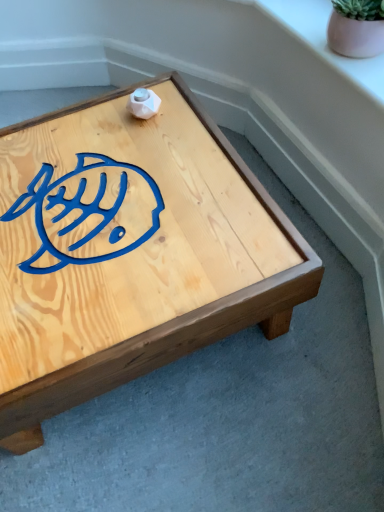
The width and height of the screenshot is (384, 512). Identify the location of pink matte flowerpot at upper right. (356, 28).

I want to click on pink ceramic pot at upper right, so click(326, 42).

What do you see at coordinates (130, 251) in the screenshot? I see `natural wood coffee table at center` at bounding box center [130, 251].

Identify the location of pink matte flowerpot at upper right. This screenshot has height=512, width=384. click(x=356, y=28).

Is pink ceramic pot at upper right far away from pink matte flowerpot at upper right?

No, pink ceramic pot at upper right is not far from pink matte flowerpot at upper right.

Does pink ceramic pot at upper right have a lesser width compared to pink matte flowerpot at upper right?

In fact, pink ceramic pot at upper right might be wider than pink matte flowerpot at upper right.

From a real-world perspective, which is physically below, pink ceramic pot at upper right or pink matte flowerpot at upper right?

pink ceramic pot at upper right.

Between natural wood coffee table at center and pink matte flowerpot at upper right, which one has more height?

natural wood coffee table at center is taller.

Is natural wood coffee table at center to the left of pink matte flowerpot at upper right from the viewer's perspective?

Correct, you'll find natural wood coffee table at center to the left of pink matte flowerpot at upper right.

From a real-world perspective, between natural wood coffee table at center and pink matte flowerpot at upper right, who is vertically higher?

In real-world perspective, pink matte flowerpot at upper right is above.

Considering the sizes of pink matte flowerpot at upper right and pink ceramic pot at upper right in the image, is pink matte flowerpot at upper right wider or thinner than pink ceramic pot at upper right?

In the image, pink matte flowerpot at upper right appears to be more narrow than pink ceramic pot at upper right.

Are pink matte flowerpot at upper right and pink ceramic pot at upper right far apart?

No, pink matte flowerpot at upper right is not far away from pink ceramic pot at upper right.

Is pink matte flowerpot at upper right facing away from pink ceramic pot at upper right?

pink matte flowerpot at upper right is not turned away from pink ceramic pot at upper right.

From the image's perspective, is pink matte flowerpot at upper right on pink ceramic pot at upper right?

No, from the image's perspective, pink matte flowerpot at upper right is not above pink ceramic pot at upper right.

Does natural wood coffee table at center have a lesser width compared to pink ceramic pot at upper right?

No, natural wood coffee table at center is not thinner than pink ceramic pot at upper right.

Is natural wood coffee table at center closer to the viewer compared to pink ceramic pot at upper right?

Yes, natural wood coffee table at center is closer to the camera.

Where is `window sill above the natural wood coffee table at center (from a real-world perspective)`? window sill above the natural wood coffee table at center (from a real-world perspective) is located at coordinates (326, 42).

Do you think pink ceramic pot at upper right is within natural wood coffee table at center, or outside of it?

pink ceramic pot at upper right lies outside natural wood coffee table at center.

Who is shorter, pink ceramic pot at upper right or natural wood coffee table at center?

Standing shorter between the two is pink ceramic pot at upper right.

Is pink ceramic pot at upper right closer to the viewer compared to natural wood coffee table at center?

No, pink ceramic pot at upper right is behind natural wood coffee table at center.

In terms of height, does pink matte flowerpot at upper right look taller or shorter compared to natural wood coffee table at center?

pink matte flowerpot at upper right is shorter than natural wood coffee table at center.

From the image's perspective, would you say pink matte flowerpot at upper right is positioned over natural wood coffee table at center?

Yes, from the image's perspective, pink matte flowerpot at upper right is above natural wood coffee table at center.

Based on the photo, in terms of size, does pink matte flowerpot at upper right appear bigger or smaller than natural wood coffee table at center?

Considering their sizes, pink matte flowerpot at upper right takes up less space than natural wood coffee table at center.

From the picture: Is pink matte flowerpot at upper right facing away from natural wood coffee table at center?

No, natural wood coffee table at center is not at the back of pink matte flowerpot at upper right.

Locate an element on the screen. This screenshot has height=512, width=384. flowerpot on the right of the pink ceramic pot at upper right is located at coordinates (356, 28).

This screenshot has width=384, height=512. What are the coordinates of `coffee table below the pink matte flowerpot at upper right (from a real-world perspective)` in the screenshot? It's located at (130, 251).

Based on their spatial positions, is natural wood coffee table at center or pink matte flowerpot at upper right closer to pink ceramic pot at upper right?

pink matte flowerpot at upper right is positioned closer to the anchor pink ceramic pot at upper right.

Estimate the real-world distances between objects in this image. Which object is further from natural wood coffee table at center, pink ceramic pot at upper right or pink matte flowerpot at upper right?

pink matte flowerpot at upper right.

In the scene shown: Estimate the real-world distances between objects in this image. Which object is closer to pink ceramic pot at upper right, pink matte flowerpot at upper right or natural wood coffee table at center?

The object closer to pink ceramic pot at upper right is pink matte flowerpot at upper right.

From the image, which object appears to be nearer to pink matte flowerpot at upper right, natural wood coffee table at center or pink ceramic pot at upper right?

pink ceramic pot at upper right is closer to pink matte flowerpot at upper right.

Based on their spatial positions, is pink ceramic pot at upper right or natural wood coffee table at center further from pink matte flowerpot at upper right?

The object further to pink matte flowerpot at upper right is natural wood coffee table at center.

Considering their positions, is pink matte flowerpot at upper right positioned further to natural wood coffee table at center than pink ceramic pot at upper right?

pink matte flowerpot at upper right is further to natural wood coffee table at center.

I want to click on window sill situated between natural wood coffee table at center and pink matte flowerpot at upper right from left to right, so click(x=326, y=42).